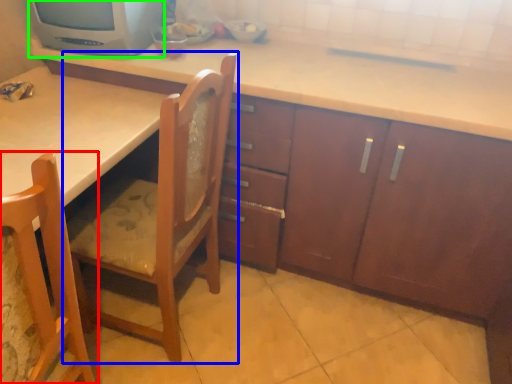
Question: Considering the real-world distances, which object is farthest from chair (highlighted by a red box)? chair (highlighted by a blue box) or home appliance (highlighted by a green box)?

Choices:
 (A) chair
 (B) home appliance

Answer: (B)